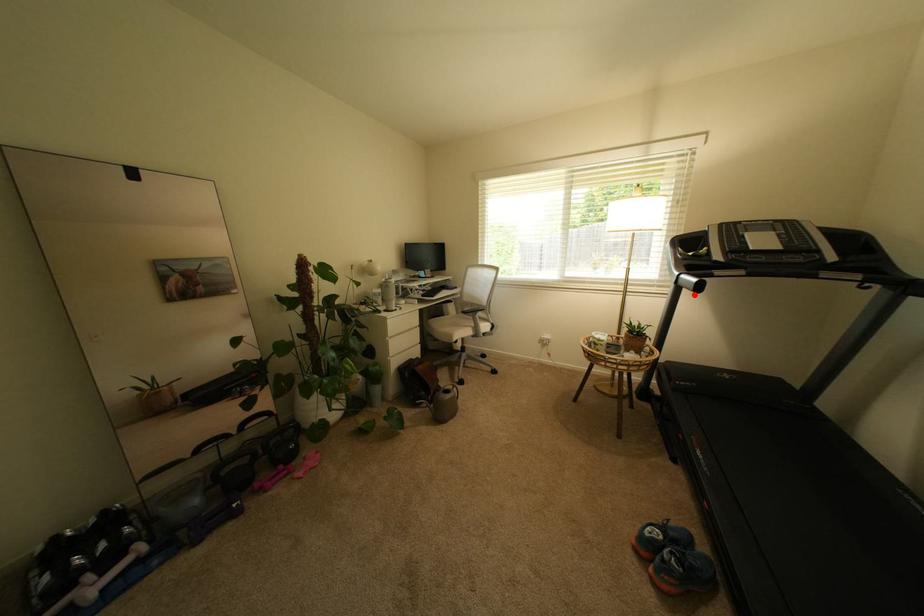
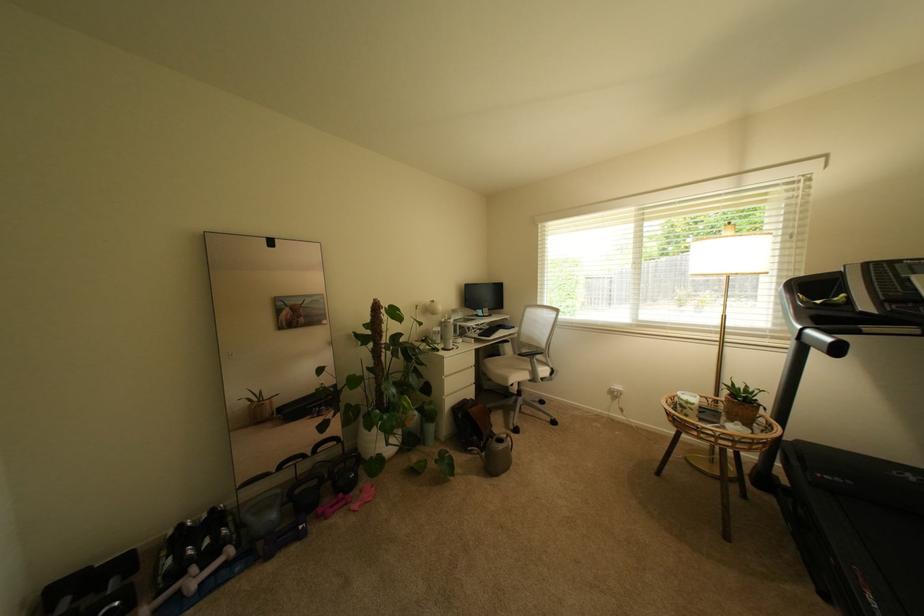
Question: I am providing you with two images of the same scene from different viewpoints. Image1 has a red point marked. In image2, the corresponding 3D location appears at what relative position? Reply with the corresponding letter.

Choices:
 (A) Closer
 (B) Farther

Answer: (B)